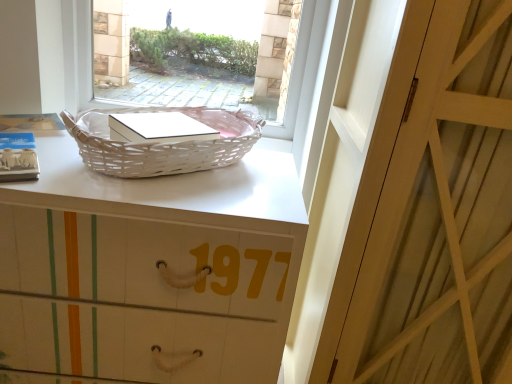
Describe the element at coordinates (150, 268) in the screenshot. I see `white matte basket at upper center` at that location.

Locate an element on the screen. The height and width of the screenshot is (384, 512). white wicker picnic basket at upper left is located at coordinates (162, 143).

In the scene shown: Which is behind, white wood door at center or white wicker basket at upper center?

Positioned behind is white wicker basket at upper center.

Locate an element on the screen. window located above the white wood door at center (from a real-world perspective) is located at coordinates [x=158, y=27].

Is white wood door at center not close to white wicker basket at upper center?

white wood door at center is far away from white wicker basket at upper center.

Considering the sizes of white wood door at center and white wicker basket at upper center in the image, is white wood door at center bigger or smaller than white wicker basket at upper center?

white wood door at center is bigger than white wicker basket at upper center.

Is white wood door at center closer to camera compared to white wicker picnic basket at upper left?

Yes, white wood door at center is closer to the camera.

Are white wood door at center and white wicker picnic basket at upper left located far from each other?

white wood door at center is actually quite close to white wicker picnic basket at upper left.

From a real-world perspective, which object stands above the other?

white wicker picnic basket at upper left, from a real-world perspective.

Consider the image. Who is shorter, white wood door at center or white wicker picnic basket at upper left?

Standing shorter between the two is white wicker picnic basket at upper left.

Is white wicker basket at upper center turned away from white wicker picnic basket at upper left?

Yes, white wicker basket at upper center is positioned with its back facing white wicker picnic basket at upper left.

From a real-world perspective, relative to white wicker picnic basket at upper left, is white wicker basket at upper center vertically above or below?

white wicker basket at upper center is situated higher than white wicker picnic basket at upper left in the real world.

Can we say white wicker basket at upper center lies outside white wicker picnic basket at upper left?

Yes, white wicker basket at upper center is outside of white wicker picnic basket at upper left.

Is white matte basket at upper center thinner than white wicker basket at upper center?

Incorrect, the width of white matte basket at upper center is not less than that of white wicker basket at upper center.

I want to click on window that appears above the white matte basket at upper center (from a real-world perspective), so click(x=158, y=27).

From a real-world perspective, which is physically below, white matte basket at upper center or white wicker basket at upper center?

white matte basket at upper center, from a real-world perspective.

Considering the positions of points (154, 252) and (128, 75), is point (154, 252) farther from camera compared to point (128, 75)?

That is False.

Considering the relative sizes of white matte basket at upper center and white wood door at center in the image provided, is white matte basket at upper center smaller than white wood door at center?

Indeed, white matte basket at upper center has a smaller size compared to white wood door at center.

Looking at this image, how different are the orientations of white matte basket at upper center and white wood door at center in degrees?

The facing directions of white matte basket at upper center and white wood door at center are 1.43 degrees apart.

Is white wood door at center at the back of white matte basket at upper center?

No.

Relative to white wood door at center, is white matte basket at upper center in front or behind?

white matte basket at upper center is positioned farther from the viewer than white wood door at center.

Considering the relative positions of white wicker basket at upper center and white wood door at center in the image provided, is white wicker basket at upper center in front of white wood door at center?

No, it is behind white wood door at center.

Is white wicker basket at upper center oriented towards white wood door at center?

No, white wicker basket at upper center does not turn towards white wood door at center.

This screenshot has height=384, width=512. In order to click on door on the right of the white wicker basket at upper center in this screenshot , I will do `click(432, 211)`.

From a real-world perspective, is white wicker basket at upper center physically located above or below white wood door at center?

From a real-world perspective, white wicker basket at upper center is physically above white wood door at center.

Does white wicker picnic basket at upper left turn towards white matte basket at upper center?

No, white wicker picnic basket at upper left is not turned towards white matte basket at upper center.

Is white wicker picnic basket at upper left taller than white matte basket at upper center?

Incorrect, the height of white wicker picnic basket at upper left is not larger of that of white matte basket at upper center.

In the scene shown: Considering the relative positions of white wicker picnic basket at upper left and white matte basket at upper center in the image provided, is white wicker picnic basket at upper left behind white matte basket at upper center?

Yes, the depth of white wicker picnic basket at upper left is greater than that of white matte basket at upper center.

Does white wicker picnic basket at upper left touch white matte basket at upper center?

No, white wicker picnic basket at upper left is not with white matte basket at upper center.

The width and height of the screenshot is (512, 384). In order to click on door below the white wicker basket at upper center (from a real-world perspective) in this screenshot , I will do `click(432, 211)`.

The image size is (512, 384). What are the coordinates of `picnic basket located above the white wood door at center (from a real-world perspective)` in the screenshot? It's located at (162, 143).

Considering their positions, is white wicker basket at upper center positioned closer to white matte basket at upper center than white wicker picnic basket at upper left?

white wicker picnic basket at upper left lies closer to white matte basket at upper center than the other object.

When comparing their distances from white wicker basket at upper center, does white matte basket at upper center or white wood door at center seem closer?

white matte basket at upper center.

Looking at the image, which one is located further to white wicker picnic basket at upper left, white matte basket at upper center or white wicker basket at upper center?

white wicker basket at upper center.

Estimate the real-world distances between objects in this image. Which object is closer to white wood door at center, white matte basket at upper center or white wicker basket at upper center?

Among the two, white matte basket at upper center is located nearer to white wood door at center.

When comparing their distances from white wicker basket at upper center, does white wicker picnic basket at upper left or white wood door at center seem closer?

Among the two, white wicker picnic basket at upper left is located nearer to white wicker basket at upper center.

From the image, which object appears to be farther from white wood door at center, white wicker basket at upper center or white wicker picnic basket at upper left?

white wicker basket at upper center lies further to white wood door at center than the other object.

Which object lies further to the anchor point white wood door at center, white wicker picnic basket at upper left or white wicker basket at upper center?

white wicker basket at upper center.

Based on their spatial positions, is white wicker picnic basket at upper left or white matte basket at upper center further from white wicker basket at upper center?

white matte basket at upper center is further to white wicker basket at upper center.

I want to click on picnic basket between white wicker basket at upper center and white matte basket at upper center vertically, so click(162, 143).

This screenshot has height=384, width=512. I want to click on picnic basket situated between white matte basket at upper center and white wood door at center from left to right, so click(x=162, y=143).

Image resolution: width=512 pixels, height=384 pixels. I want to click on window between white matte basket at upper center and white wood door at center in the horizontal direction, so click(158, 27).

You are a GUI agent. You are given a task and a screenshot of the screen. Output one action in this format:
    pyautogui.click(x=<x>, y=<y>)
    Task: Click on the picnic basket between white wicker basket at upper center and white wood door at center
    The height and width of the screenshot is (384, 512).
    Given the screenshot: What is the action you would take?
    pyautogui.click(x=162, y=143)